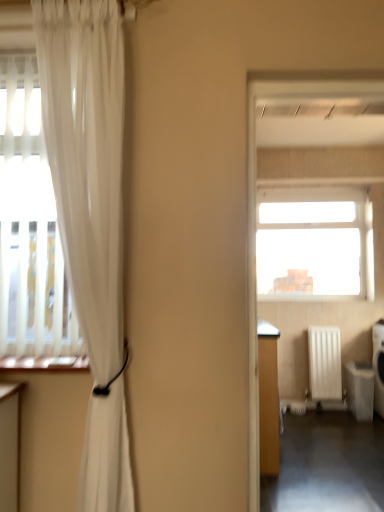
Locate an element on the screen. This screenshot has height=512, width=384. free space above white matte radiator at right (from a real-world perspective) is located at coordinates [323, 329].